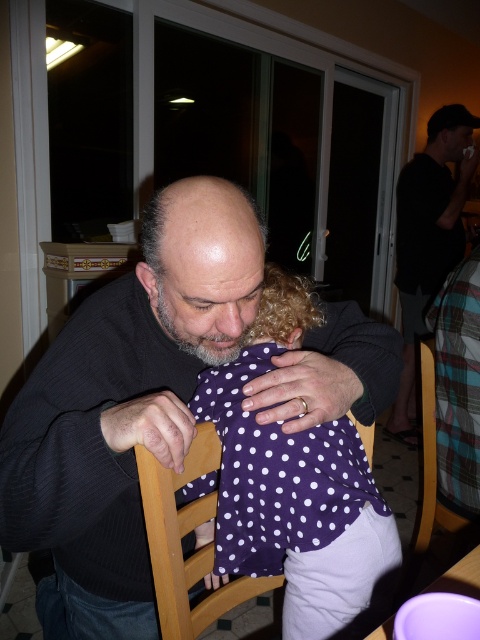
Is yellow plastic chair at right bigger than purple plastic table at lower right?

Indeed, yellow plastic chair at right has a larger size compared to purple plastic table at lower right.

Which is in front, point (422, 342) or point (384, 636)?

Point (384, 636) is more forward.

This screenshot has height=640, width=480. Identify the location of yellow plastic chair at right. (431, 461).

Does purple dotted fabric at center appear under wooden chair at lower center?

Incorrect, purple dotted fabric at center is not positioned below wooden chair at lower center.

Locate an element on the screen. purple dotted fabric at center is located at coordinates (275, 474).

Is black sweater at center wider than wooden chair at lower center?

Correct, the width of black sweater at center exceeds that of wooden chair at lower center.

Can you confirm if black sweater at center is positioned to the right of wooden chair at lower center?

A: Indeed, black sweater at center is positioned on the right side of wooden chair at lower center.

Which is in front, point (445, 116) or point (257, 582)?

Point (257, 582) is in front.

In order to click on black sweater at center in this screenshot , I will do `click(429, 236)`.